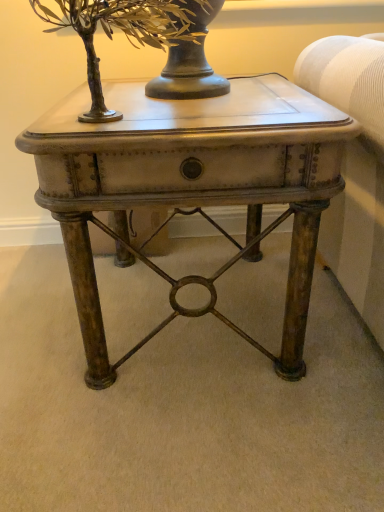
Where is `vacant region above matte brown side table at center (from a real-world perspective)`? This screenshot has width=384, height=512. vacant region above matte brown side table at center (from a real-world perspective) is located at coordinates (191, 103).